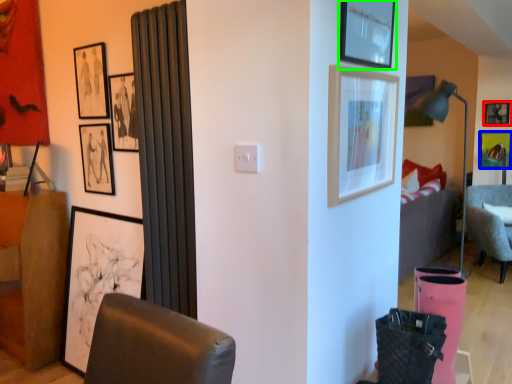
Question: Which object is positioned closest to picture frame (highlighted by a red box)? Select from picture frame (highlighted by a blue box) and picture frame (highlighted by a green box).

Choices:
 (A) picture frame
 (B) picture frame

Answer: (A)